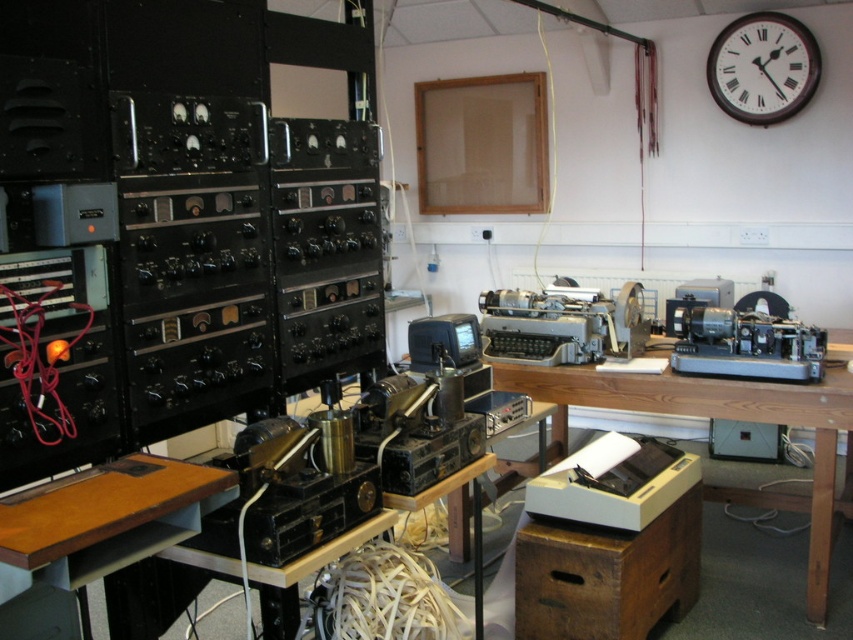
Which is behind, point (548, 321) or point (766, 90)?

The point (766, 90) is behind.

Can you confirm if metallic gray typewriter at center is bigger than brown wooden clock at upper right?

Yes.

Measure the distance between point [567,364] and camera.

2.97 meters

I want to click on metallic gray typewriter at center, so click(561, 324).

How far apart are wooden table at center and brown wooden clock at upper right?

wooden table at center is 1.77 meters away from brown wooden clock at upper right.

Is wooden table at center above brown wooden clock at upper right?

No, wooden table at center is not above brown wooden clock at upper right.

Locate an element on the screen. This screenshot has width=853, height=640. wooden table at center is located at coordinates (728, 419).

The height and width of the screenshot is (640, 853). I want to click on wooden table at center, so tap(728, 419).

Is wooden table at center further to the viewer compared to metallic gray typewriter at center?

That is False.

From the picture: Does wooden table at center come in front of metallic gray typewriter at center?

A: That is True.

Who is more distant from viewer, (x=838, y=349) or (x=624, y=308)?

The point (x=838, y=349) is more distant.

Find the location of `wooden table at center`. wooden table at center is located at coordinates (728, 419).